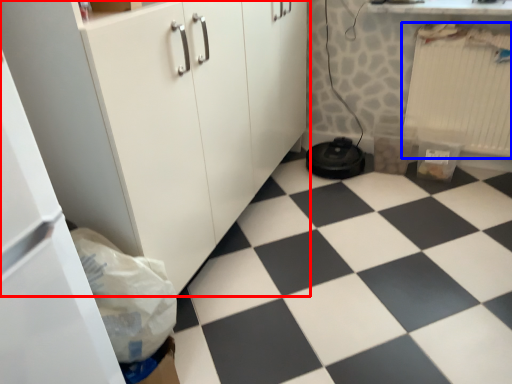
Question: Which object appears farthest to the camera in this image, cabinetry (highlighted by a red box) or radiator (highlighted by a blue box)?

Choices:
 (A) cabinetry
 (B) radiator

Answer: (B)